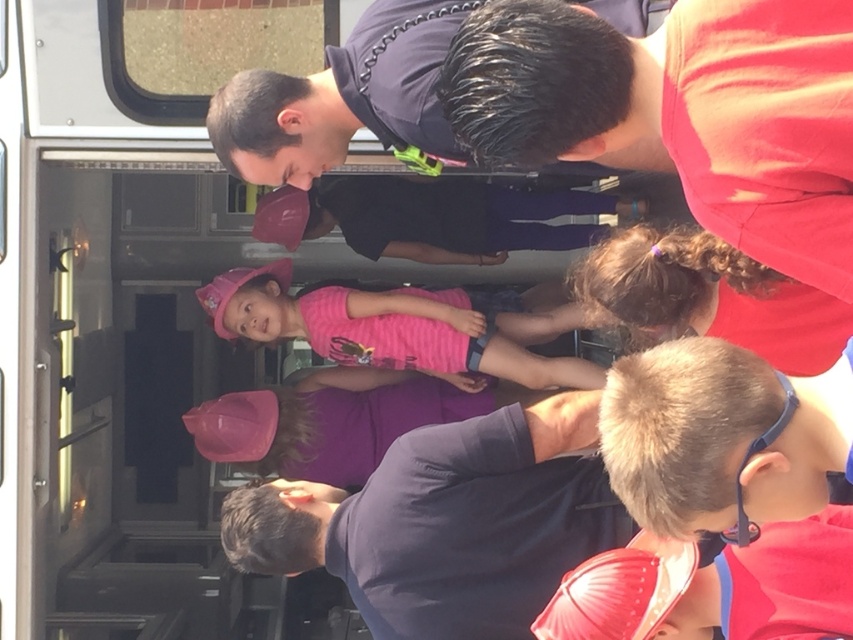
You are a photographer trying to capture a clear shot of both the red matte shirt at upper right and the pink fabric shirt at center. Since you want both subjects to be in focus, which one should you focus on first to ensure depth of field?

You should focus on the red matte shirt at upper right first because it is closer to the viewer than the pink fabric shirt at center, allowing the depth of field to extend backward to include both subjects.